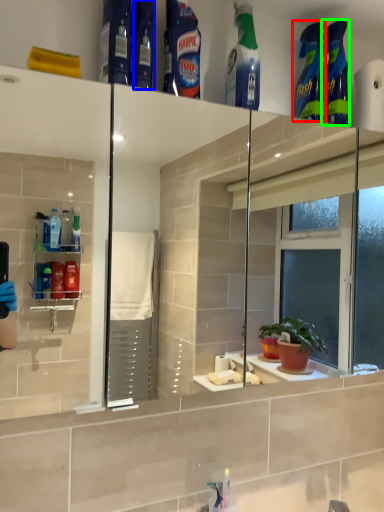
Question: Estimate the real-world distances between objects in this image. Which object is farther from cleaning product (highlighted by a red box), toiletry (highlighted by a blue box) or cleaning product (highlighted by a green box)?

Choices:
 (A) toiletry
 (B) cleaning product

Answer: (A)